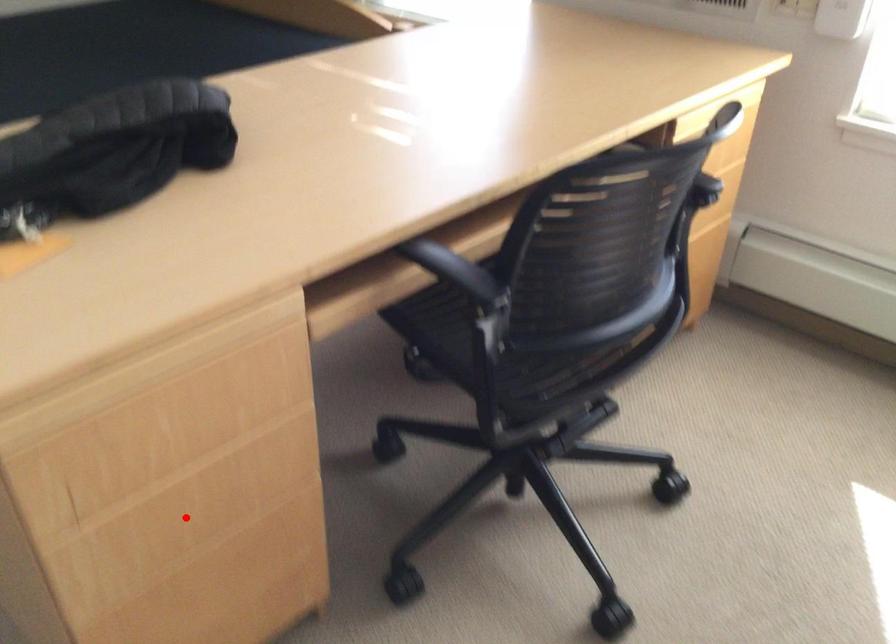
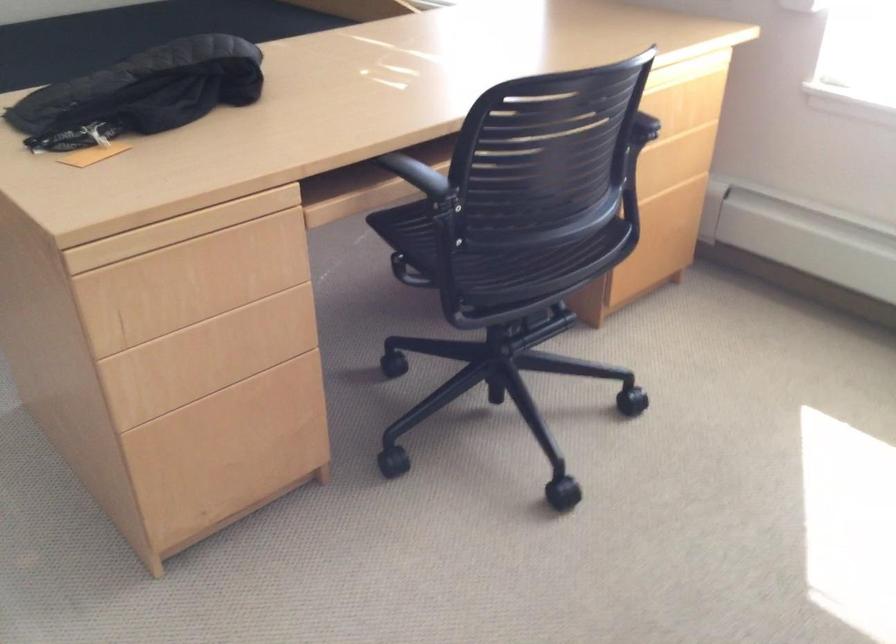
In the second image, find the point that corresponds to the highlighted location in the first image.

(201, 361)